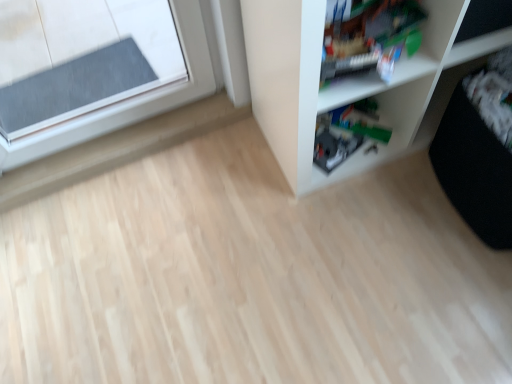
I want to click on translucent plastic toy at upper right, so click(x=368, y=35).

What do you see at coordinates (368, 35) in the screenshot? This screenshot has width=512, height=384. I see `translucent plastic toy at upper right` at bounding box center [368, 35].

At what (x,y) coordinates should I click in order to perform the action: click on white plastic shelf at upper right. Please return your answer as a coordinate pair (x, y). The height and width of the screenshot is (384, 512). Looking at the image, I should click on (347, 83).

Describe the element at coordinates (347, 83) in the screenshot. I see `white plastic shelf at upper right` at that location.

Find the location of a particular element. This screenshot has width=512, height=384. translucent plastic toy at upper right is located at coordinates (368, 35).

Considering the positions of objects translucent plastic toy at upper right and white plastic shelf at upper right in the image provided, who is more to the left, translucent plastic toy at upper right or white plastic shelf at upper right?

translucent plastic toy at upper right.

Is translucent plastic toy at upper right further to the viewer compared to white plastic shelf at upper right?

Yes, it is behind white plastic shelf at upper right.

Which is further, (x=367, y=4) or (x=403, y=85)?

The point (x=403, y=85) is more distant.

From the image's perspective, is translucent plastic toy at upper right above or below white plastic shelf at upper right?

translucent plastic toy at upper right is situated lower than white plastic shelf at upper right in the image.

From a real-world perspective, is translucent plastic toy at upper right below white plastic shelf at upper right?

No.

Which object is wider, translucent plastic toy at upper right or white plastic shelf at upper right?

white plastic shelf at upper right is wider.

Which of these two, translucent plastic toy at upper right or white plastic shelf at upper right, stands taller?

With more height is white plastic shelf at upper right.

Who is smaller, translucent plastic toy at upper right or white plastic shelf at upper right?

Smaller between the two is translucent plastic toy at upper right.

In the scene shown: Is translucent plastic toy at upper right spatially inside white plastic shelf at upper right, or outside of it?

translucent plastic toy at upper right is located inside white plastic shelf at upper right.

Is translucent plastic toy at upper right in contact with white plastic shelf at upper right?

No, translucent plastic toy at upper right is not next to white plastic shelf at upper right.

Looking at this image, could you tell me if translucent plastic toy at upper right is facing white plastic shelf at upper right?

Yes, translucent plastic toy at upper right is oriented towards white plastic shelf at upper right.

This screenshot has width=512, height=384. I want to click on shelf in front of the translucent plastic toy at upper right, so click(x=347, y=83).

In the image, is white plastic shelf at upper right on the left side or the right side of translucent plastic toy at upper right?

white plastic shelf at upper right is to the right of translucent plastic toy at upper right.

Considering the positions of objects white plastic shelf at upper right and translucent plastic toy at upper right in the image provided, who is in front, white plastic shelf at upper right or translucent plastic toy at upper right?

white plastic shelf at upper right is closer to the camera.

Is point (312, 122) behind point (380, 40)?

That is True.

From the image's perspective, is white plastic shelf at upper right above or below translucent plastic toy at upper right?

white plastic shelf at upper right is above translucent plastic toy at upper right.

From a real-world perspective, is white plastic shelf at upper right on top of translucent plastic toy at upper right?

No, from a real-world perspective, white plastic shelf at upper right is not above translucent plastic toy at upper right.

Between white plastic shelf at upper right and translucent plastic toy at upper right, which one has smaller width?

Thinner between the two is translucent plastic toy at upper right.

Is white plastic shelf at upper right shorter than translucent plastic toy at upper right?

No.

Considering the sizes of objects white plastic shelf at upper right and translucent plastic toy at upper right in the image provided, who is bigger, white plastic shelf at upper right or translucent plastic toy at upper right?

Bigger between the two is white plastic shelf at upper right.

Would you say white plastic shelf at upper right is inside or outside translucent plastic toy at upper right?

white plastic shelf at upper right is not enclosed by translucent plastic toy at upper right.

Looking at this image, does white plastic shelf at upper right touch translucent plastic toy at upper right?

They are not placed beside each other.

Does white plastic shelf at upper right turn towards translucent plastic toy at upper right?

Yes, white plastic shelf at upper right is turned towards translucent plastic toy at upper right.

Where is `shelf that appears below the translucent plastic toy at upper right (from a real-world perspective)`? Image resolution: width=512 pixels, height=384 pixels. shelf that appears below the translucent plastic toy at upper right (from a real-world perspective) is located at coordinates (347, 83).

You are a GUI agent. You are given a task and a screenshot of the screen. Output one action in this format:
    pyautogui.click(x=<x>, y=<y>)
    Task: Click on the toy above the white plastic shelf at upper right (from a real-world perspective)
    This screenshot has width=512, height=384.
    Given the screenshot: What is the action you would take?
    pyautogui.click(x=368, y=35)

I want to click on shelf above the translucent plastic toy at upper right (from the image's perspective), so click(x=347, y=83).